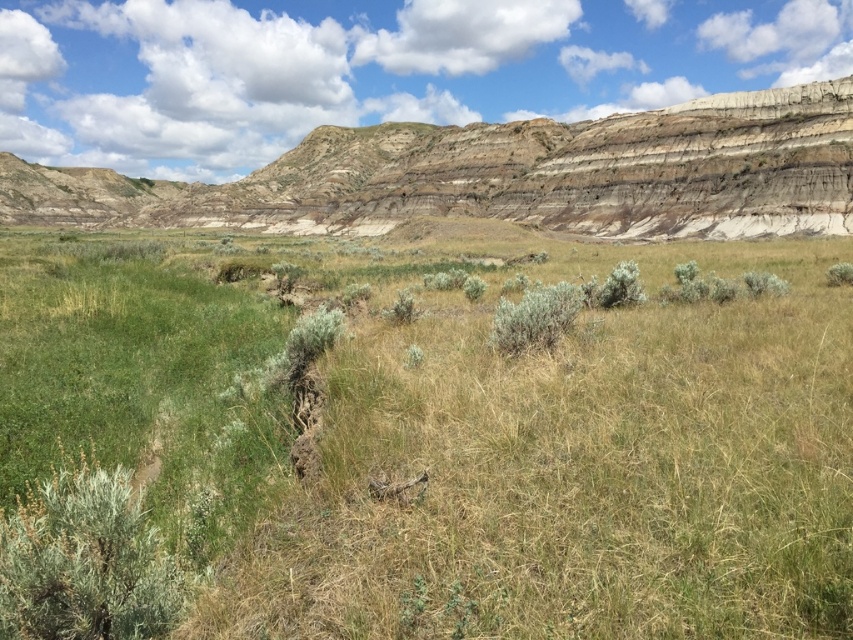
Can you confirm if green grass at center is taller than green fuzzy bush at lower left?

Yes, green grass at center is taller than green fuzzy bush at lower left.

Is point (751, 486) positioned before point (55, 564)?

That is False.

Image resolution: width=853 pixels, height=640 pixels. In order to click on green grass at center in this screenshot , I will do `click(457, 442)`.

Does clay-textured cliff at upper center have a lesser height compared to green fuzzy bush at center?

Incorrect, clay-textured cliff at upper center's height does not fall short of green fuzzy bush at center's.

Who is positioned more to the right, clay-textured cliff at upper center or green fuzzy bush at center?

Positioned to the right is green fuzzy bush at center.

Which is behind, point (335, 212) or point (569, 314)?

Point (335, 212)

Find the location of a particular element. clay-textured cliff at upper center is located at coordinates (509, 176).

The height and width of the screenshot is (640, 853). Describe the element at coordinates (457, 442) in the screenshot. I see `green grass at center` at that location.

Is point (518, 496) more distant than point (131, 180)?

No, (518, 496) is in front of (131, 180).

This screenshot has width=853, height=640. I want to click on green grass at center, so pos(457,442).